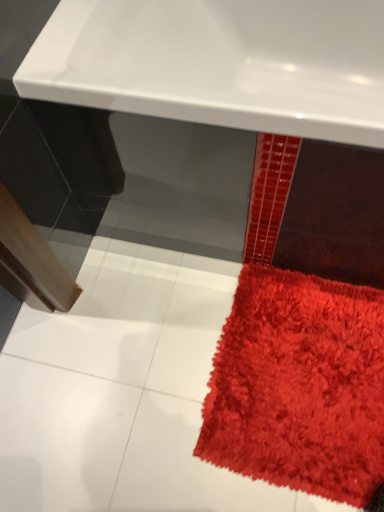
Question: Can you confirm if shaggy red rug at lower right is shorter than white glossy sink at upper center?

Choices:
 (A) yes
 (B) no

Answer: (A)

Question: Is shaggy red rug at lower right turned away from white glossy sink at upper center?

Choices:
 (A) no
 (B) yes

Answer: (A)

Question: Does shaggy red rug at lower right turn towards white glossy sink at upper center?

Choices:
 (A) yes
 (B) no

Answer: (B)

Question: Is shaggy red rug at lower right at the right side of white glossy sink at upper center?

Choices:
 (A) yes
 (B) no

Answer: (A)

Question: Is shaggy red rug at lower right completely or partially outside of white glossy sink at upper center?

Choices:
 (A) yes
 (B) no

Answer: (A)

Question: Can you confirm if shaggy red rug at lower right is smaller than white glossy sink at upper center?

Choices:
 (A) no
 (B) yes

Answer: (B)

Question: Considering the relative sizes of white glossy sink at upper center and shaggy red rug at lower right in the image provided, is white glossy sink at upper center shorter than shaggy red rug at lower right?

Choices:
 (A) no
 (B) yes

Answer: (A)

Question: Is white glossy sink at upper center in front of shaggy red rug at lower right?

Choices:
 (A) no
 (B) yes

Answer: (B)

Question: Is white glossy sink at upper center positioned with its back to shaggy red rug at lower right?

Choices:
 (A) no
 (B) yes

Answer: (A)

Question: Considering the relative sizes of white glossy sink at upper center and shaggy red rug at lower right in the image provided, is white glossy sink at upper center smaller than shaggy red rug at lower right?

Choices:
 (A) no
 (B) yes

Answer: (A)

Question: From the image's perspective, would you say white glossy sink at upper center is positioned over shaggy red rug at lower right?

Choices:
 (A) yes
 (B) no

Answer: (A)

Question: Is shaggy red rug at lower right surrounded by white glossy sink at upper center?

Choices:
 (A) yes
 (B) no

Answer: (B)

Question: Considering the positions of shaggy red rug at lower right and white glossy sink at upper center in the image, is shaggy red rug at lower right wider or thinner than white glossy sink at upper center?

Choices:
 (A) thin
 (B) wide

Answer: (A)